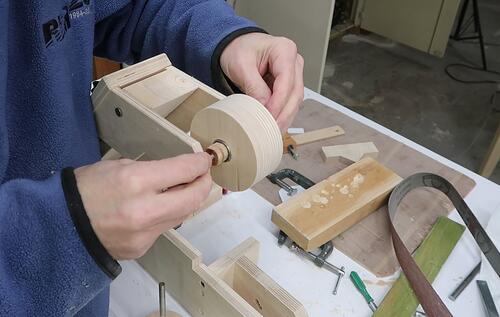
You are a GUI agent. You are given a task and a screenshot of the screen. Output one action in this format:
    pyautogui.click(x=<x>, y=<y>)
    Task: Click on the concrete floor
    
    Given the screenshot: What is the action you would take?
    pyautogui.click(x=401, y=86)